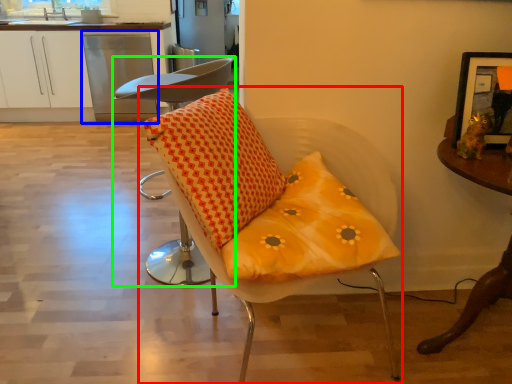
Question: Which is farther away from chair (highlighted by a red box)? dish washer (highlighted by a blue box) or chair (highlighted by a green box)?

Choices:
 (A) dish washer
 (B) chair

Answer: (A)